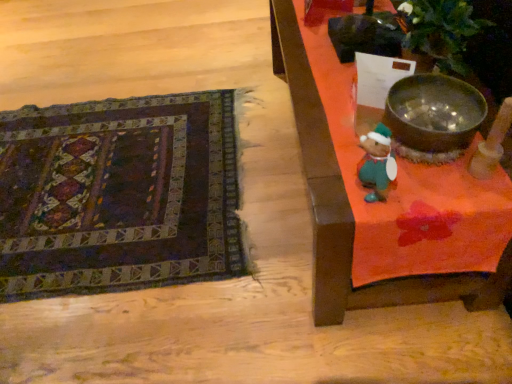
Find the location of `free space in front of shiny metallic bowl at upper right`. free space in front of shiny metallic bowl at upper right is located at coordinates (444, 196).